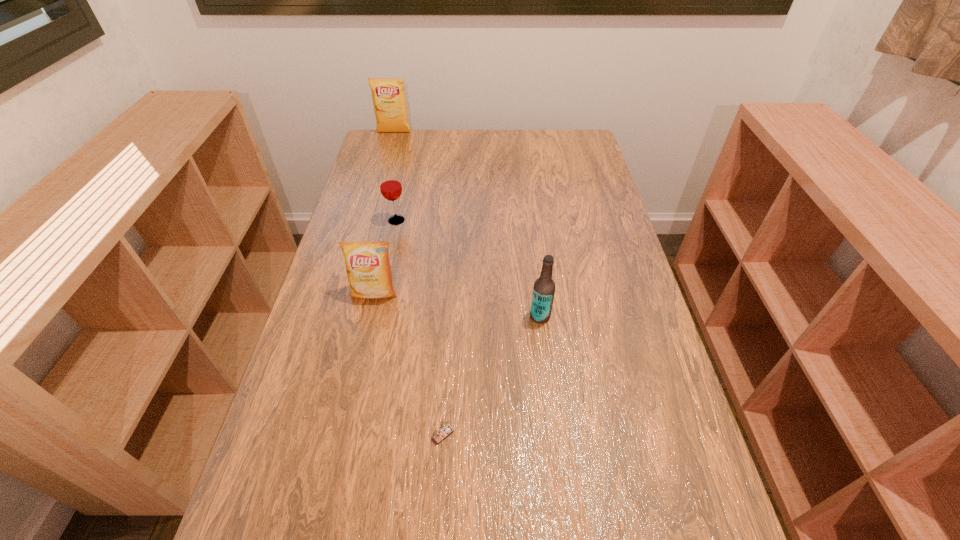
Find the location of `blank region between the beer bottle and the fourth nearest object`. blank region between the beer bottle and the fourth nearest object is located at coordinates (468, 268).

Locate which object ranks fourth in proximity to the matchbox. Please provide its 2D coordinates. Your answer should be formatted as a tuple, i.e. [(x, y)], where the tuple contains the x and y coordinates of a point satisfying the conditions above.

[(388, 94)]

Choose which object is the third nearest neighbor to the beer bottle. Please provide its 2D coordinates. Your answer should be formatted as a tuple, i.e. [(x, y)], where the tuple contains the x and y coordinates of a point satisfying the conditions above.

[(390, 184)]

Where is `vacant region that satisfies the following two spatial constraints: 1. on the front-facing side of the matchbox; 2. on the left side of the nearer crisp (potato chip)`? vacant region that satisfies the following two spatial constraints: 1. on the front-facing side of the matchbox; 2. on the left side of the nearer crisp (potato chip) is located at coordinates [343, 435].

Locate an element on the screen. blank area in the image that satisfies the following two spatial constraints: 1. on the front side of the glass; 2. on the right side of the nearest object is located at coordinates (351, 435).